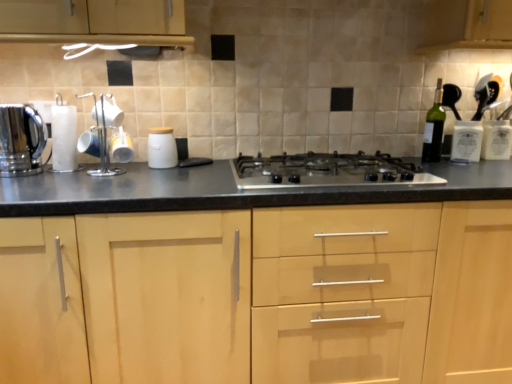
Locate an element on the screen. The width and height of the screenshot is (512, 384). free point below polished stainless steel kettle at left, the 1th kitchen appliance from the left (from a real-world perspective) is located at coordinates (24, 173).